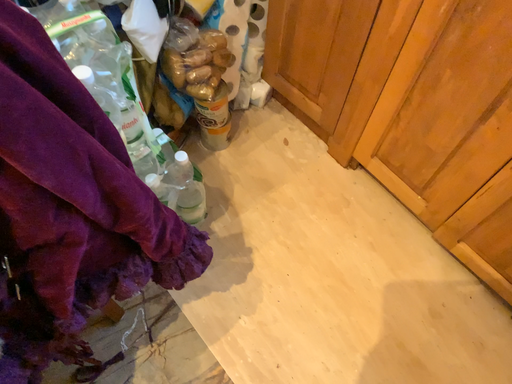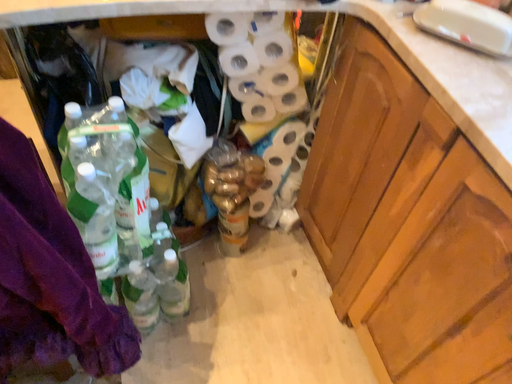
Question: Which way did the camera rotate in the video?

Choices:
 (A) rotated upward
 (B) rotated downward

Answer: (A)